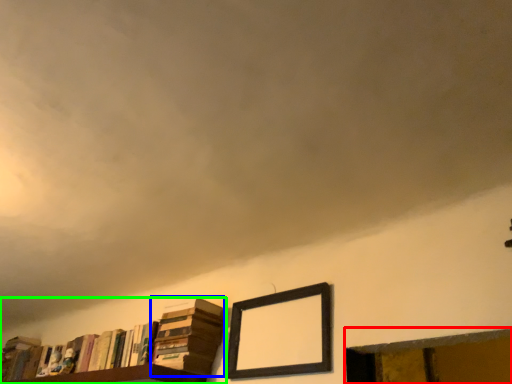
Question: Considering the real-world distances, which object is farthest from window frame (highlighted by a red box)? book (highlighted by a blue box) or book (highlighted by a green box)?

Choices:
 (A) book
 (B) book

Answer: (B)